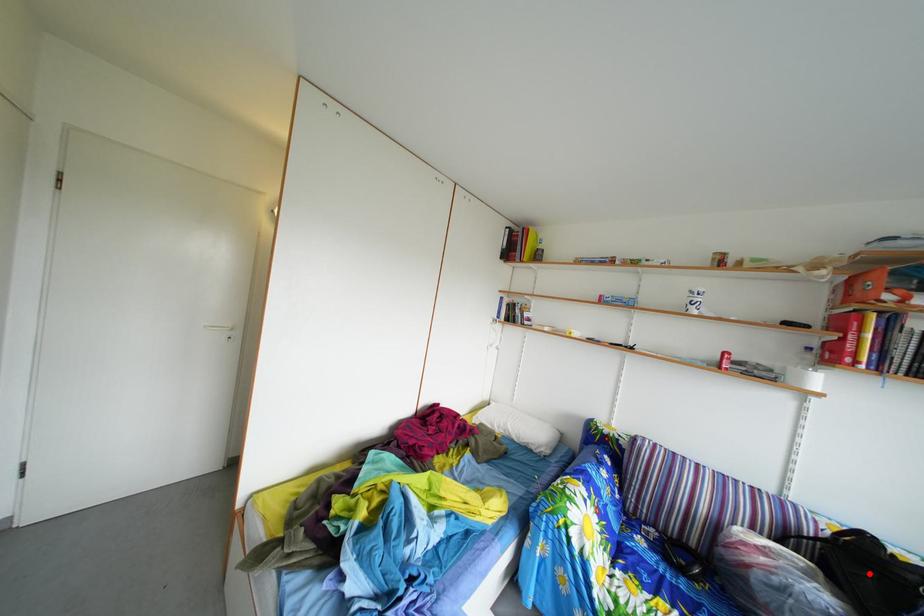
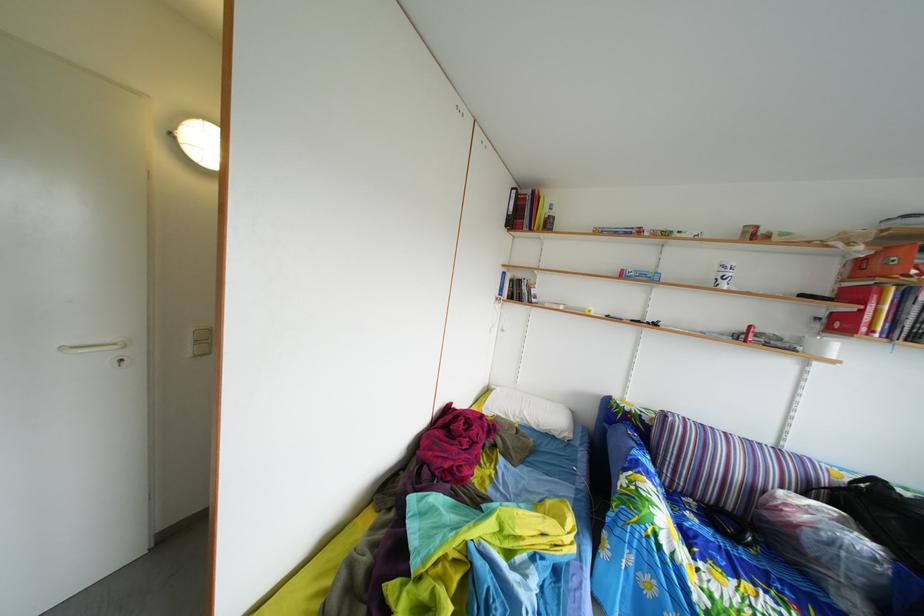
In the second image, find the point that corresponds to the highlighted location in the first image.

(886, 515)